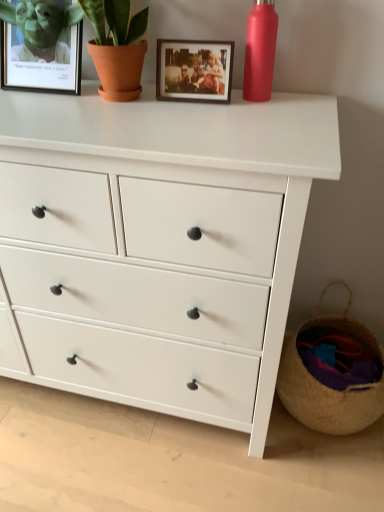
In order to click on vacant space that is to the left of matte red bottle at upper right in this screenshot , I will do `click(187, 104)`.